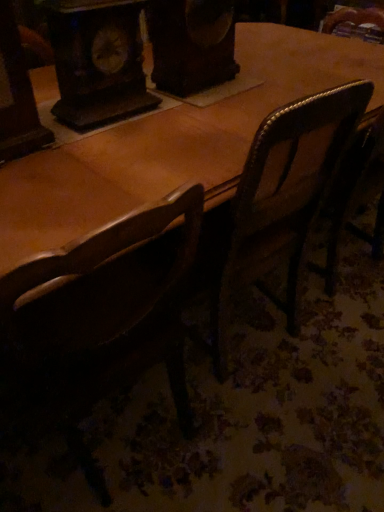
Image resolution: width=384 pixels, height=512 pixels. In order to click on vacant area that lies to the right of wooden clock at upper left in this screenshot , I will do `click(182, 114)`.